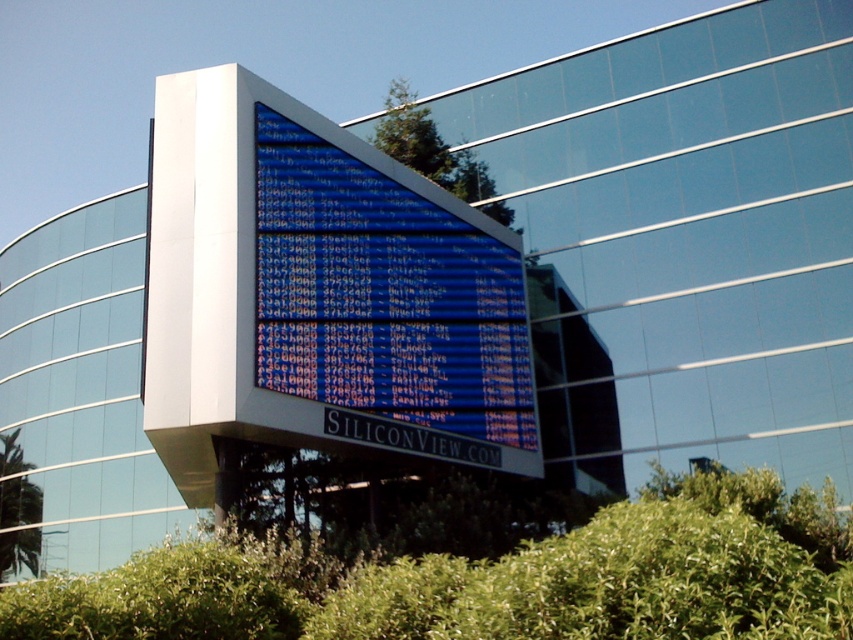
Is point (445, 147) farther from camera compared to point (39, 550)?

No, (445, 147) is closer to viewer.

How far apart are green leafy tree at upper center and green leafy tree at lower left?

105.76 feet

Image resolution: width=853 pixels, height=640 pixels. What are the coordinates of `green leafy tree at upper center` in the screenshot? It's located at (427, 147).

Can you confirm if blue glossy sign at center is smaller than green leafy tree at lower left?

No, blue glossy sign at center is not smaller than green leafy tree at lower left.

Between blue glossy sign at center and green leafy tree at lower left, which one is positioned higher?

blue glossy sign at center is above.

The image size is (853, 640). Describe the element at coordinates (383, 296) in the screenshot. I see `blue glossy sign at center` at that location.

Find the location of `blue glossy sign at center`. blue glossy sign at center is located at coordinates (383, 296).

Does blue glossy sign at center have a greater height compared to green leafy tree at upper center?

Incorrect, blue glossy sign at center's height is not larger of green leafy tree at upper center's.

Consider the image. Is the position of blue glossy sign at center less distant than that of green leafy tree at upper center?

Yes, it is.

This screenshot has width=853, height=640. What are the coordinates of `blue glossy sign at center` in the screenshot? It's located at (383, 296).